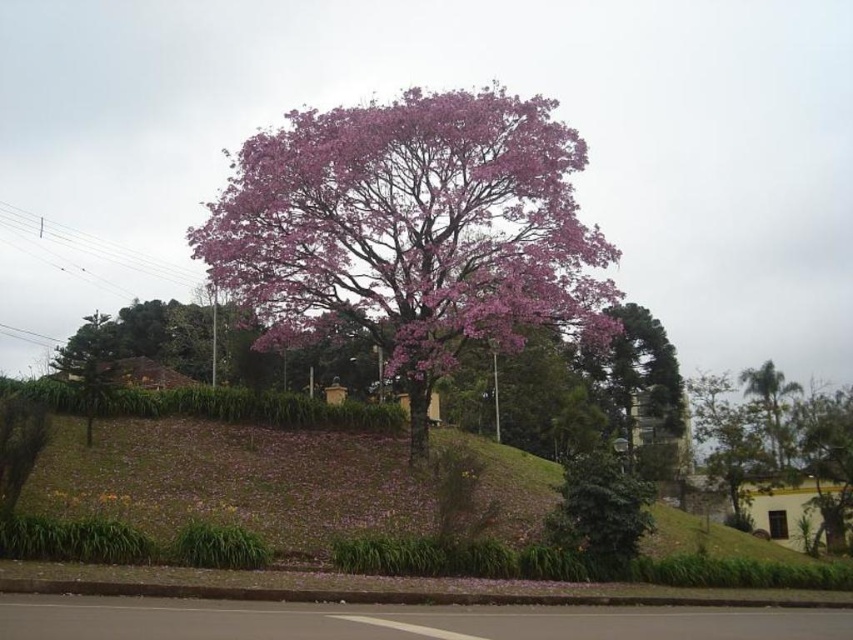
Who is higher up, pink matte tree at center or green leafy palm at right?

pink matte tree at center is higher up.

The image size is (853, 640). Describe the element at coordinates (413, 228) in the screenshot. I see `pink matte tree at center` at that location.

Is point (422, 276) closer to viewer compared to point (785, 464)?

Yes, it is in front of point (785, 464).

Where is `pink matte tree at center`? The image size is (853, 640). pink matte tree at center is located at coordinates (413, 228).